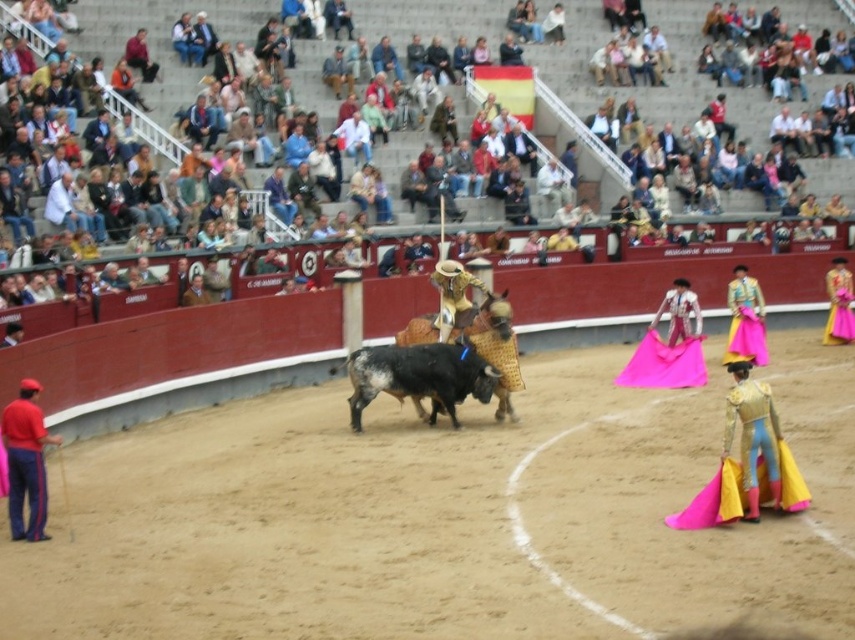
Looking at this image, you are a photographer positioned at the edge of the arena. You need to capture a photo of the black glossy bull at center and the red fabric pants at lower left. Based on their heights, which one will appear taller in the photo?

The red fabric pants at lower left are taller than the black glossy bull at center, so they will appear taller in the photo.

You are a photographer standing at the edge of the arena. You want to capture a photo of the black glossy bull at center and the yellow satin cape at lower right without any overlap. Can you position yourself so that the bull is to the left of the cape in the photo?

The black glossy bull at center might be wider than yellow satin cape at lower right, so positioning yourself to have the bull to the left of the cape in the photo without overlap depends on their actual widths. If the bull is wider, you need more space between them in the frame.

You are a torero in the arena and want to safely move to the edge of the arena. The black glossy bull at center is charging towards you. Given that the arena has a radius of 50 feet, can you reach the edge before the bull reaches you if you start running towards it at the same time?

The black glossy bull at center and viewer are 80.96 feet apart from each other. The arena has a radius of 50 feet, so the distance from the center to the edge is 50 feet. Since the bull is at the center, you are 80.96 feet away from it, meaning you are already beyond the edge of the arena. Therefore, you are already at or beyond the edge and safe.